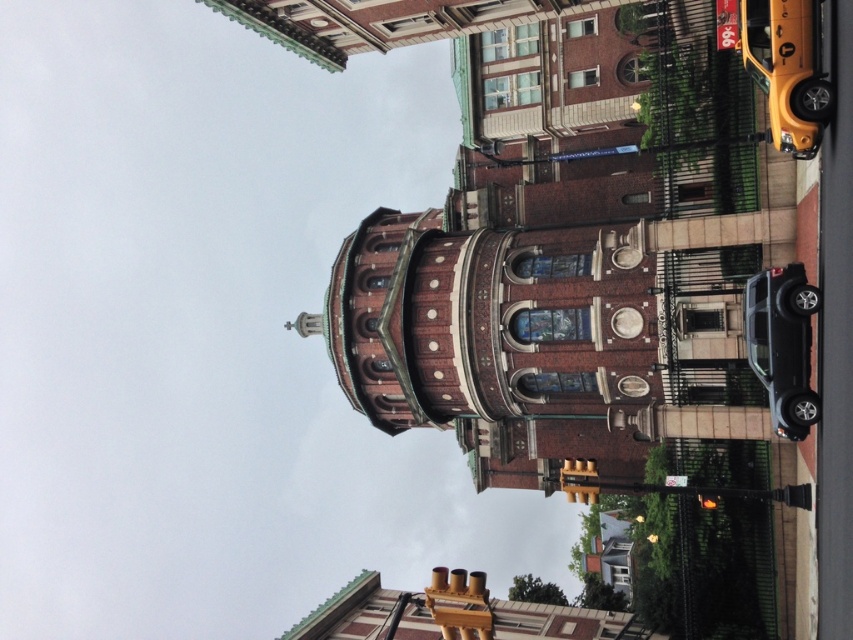
Is yellow rubber taxi at upper right smaller than shiny black suv at lower right?

Incorrect, yellow rubber taxi at upper right is not smaller in size than shiny black suv at lower right.

Between yellow rubber taxi at upper right and shiny black suv at lower right, which one is positioned lower?

shiny black suv at lower right is lower down.

Where is `yellow rubber taxi at upper right`? yellow rubber taxi at upper right is located at coordinates (787, 68).